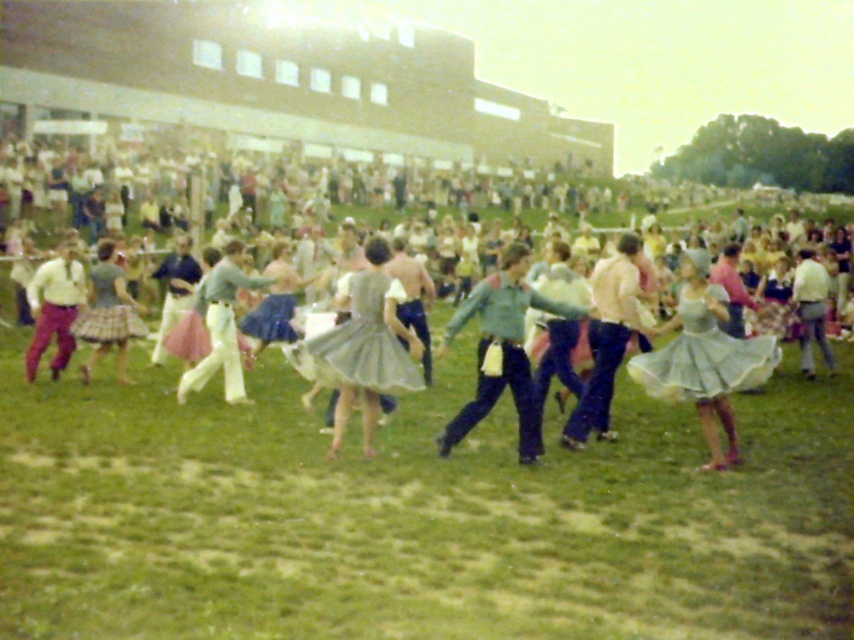
You are a photographer at the event and want to capture a photo of the green satin dress at center and the light gray taffeta skirt at center. Which one of these two items has a wider silhouette?

The green satin dress at center has a wider silhouette than the light gray taffeta skirt at center.

You are a photographer trying to capture the square dance scene. You notice two items of clothing in the frame. The first is a matte yellow shirt at left, and the second is a plaid fabric skirt at center. Which of these two items of clothing appears larger in the photo?

The matte yellow shirt at left appears larger than the plaid fabric skirt at center in the photo.

You are a photographer at the event and want to capture a photo of the matte yellow shirt at left and the plaid fabric skirt at center. Based on their positions, which object is positioned more to the left side of the frame?

The matte yellow shirt at left is positioned to the left of the plaid fabric skirt at center, so the matte yellow shirt at left is more to the left side of the frame.